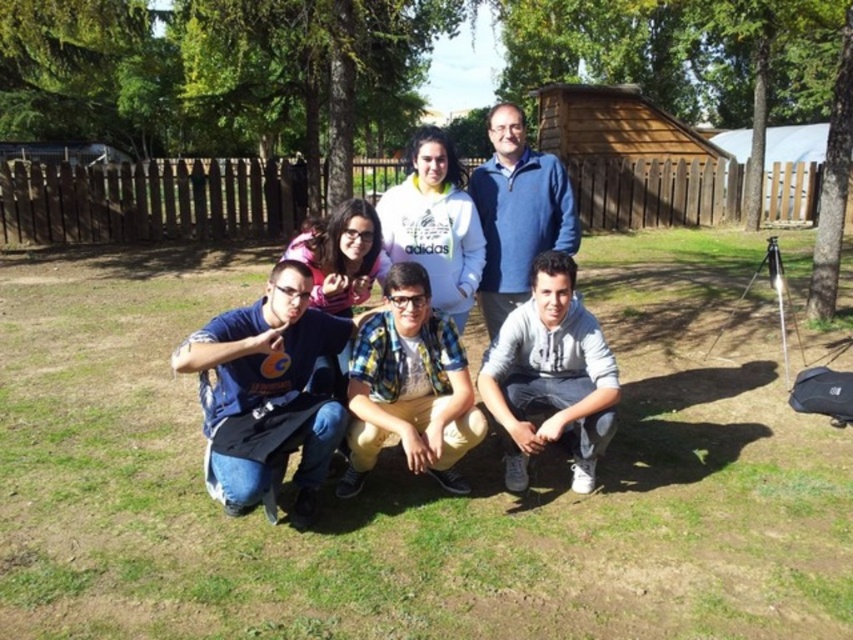
You are standing at the point labeled as point (379, 486) in the image. A frisbee is thrown from your current position. If the frisbee flies straight for 3 meters, will it land within the park area enclosed by the wooden fence?

The distance between you and the viewer is 3.51 meters. Since the frisbee only flies 3 meters, it won not reach the viewer and thus will land within the park area enclosed by the wooden fence.